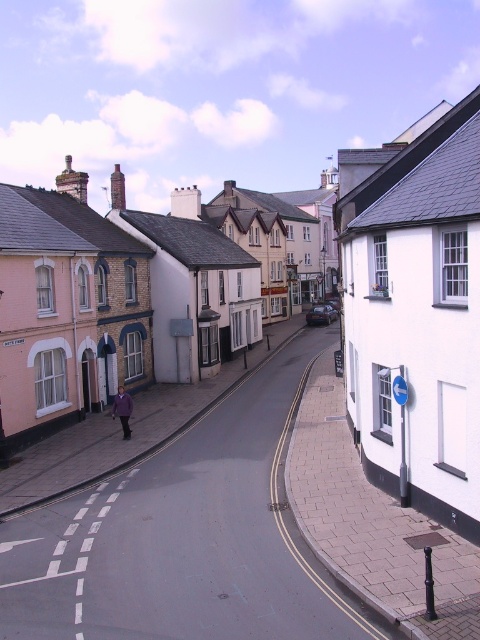
Question: Is white matte building at center closer to camera compared to purple fabric jacket at center?

Choices:
 (A) no
 (B) yes

Answer: (B)

Question: Does white matte building at center appear under purple fabric jacket at center?

Choices:
 (A) no
 (B) yes

Answer: (A)

Question: Does white matte building at center have a lesser width compared to purple fabric jacket at center?

Choices:
 (A) yes
 (B) no

Answer: (B)

Question: Which point is closer to the camera?

Choices:
 (A) (121, 424)
 (B) (381, 147)

Answer: (A)

Question: Which object appears farthest from the camera in this image?

Choices:
 (A) purple fabric jacket at center
 (B) white matte building at center

Answer: (A)

Question: Which of the following is the farthest from the observer?

Choices:
 (A) purple fabric jacket at center
 (B) white matte building at center

Answer: (A)